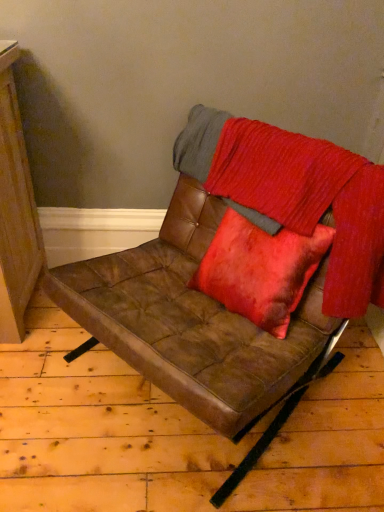
This screenshot has width=384, height=512. Describe the element at coordinates (213, 305) in the screenshot. I see `brown leather chair at center` at that location.

At what (x,y) coordinates should I click in order to perform the action: click on brown leather chair at center. Please return your answer as a coordinate pair (x, y). This screenshot has width=384, height=512. Looking at the image, I should click on (x=213, y=305).

The image size is (384, 512). Describe the element at coordinates (295, 195) in the screenshot. I see `velvet red blanket at center` at that location.

Where is `velvet red blanket at center`? velvet red blanket at center is located at coordinates (295, 195).

The width and height of the screenshot is (384, 512). What are the coordinates of `brown leather chair at center` in the screenshot? It's located at (213, 305).

Based on their positions, is velvet red blanket at center located to the left or right of brown leather chair at center?

Based on their positions, velvet red blanket at center is located to the right of brown leather chair at center.

Is velvet red blanket at center positioned before brown leather chair at center?

No, velvet red blanket at center is further to the viewer.

Does point (357, 290) come in front of point (81, 275)?

Yes, point (357, 290) is closer to viewer.

From the image's perspective, which is below, velvet red blanket at center or brown leather chair at center?

brown leather chair at center, from the image's perspective.

From a real-world perspective, relative to brown leather chair at center, is velvet red blanket at center vertically above or below?

In terms of real-world spatial position, velvet red blanket at center is above brown leather chair at center.

Between velvet red blanket at center and brown leather chair at center, which one has larger width?

brown leather chair at center is wider.

Who is shorter, velvet red blanket at center or brown leather chair at center?

With less height is velvet red blanket at center.

Is velvet red blanket at center smaller than brown leather chair at center?

Yes, velvet red blanket at center is smaller than brown leather chair at center.

Is velvet red blanket at center completely or partially outside of brown leather chair at center?

That's incorrect, velvet red blanket at center is not completely outside brown leather chair at center.

Consider the image. Is velvet red blanket at center with brown leather chair at center?

velvet red blanket at center and brown leather chair at center are clearly separated.

Is brown leather chair at center at the back of velvet red blanket at center?

Correct, velvet red blanket at center is looking away from brown leather chair at center.

Can you tell me how much velvet red blanket at center and brown leather chair at center differ in facing direction?

0.00124 degrees separate the facing orientations of velvet red blanket at center and brown leather chair at center.

Locate an element on the screen. The width and height of the screenshot is (384, 512). chair below the velvet red blanket at center (from the image's perspective) is located at coordinates (213, 305).

Which is more to the right, brown leather chair at center or velvet red blanket at center?

velvet red blanket at center.

Which object is further away from the camera, brown leather chair at center or velvet red blanket at center?

velvet red blanket at center.

Between point (201, 407) and point (193, 152), which one is positioned in front?

Positioned in front is point (201, 407).

From the image's perspective, which one is positioned higher, brown leather chair at center or velvet red blanket at center?

velvet red blanket at center.

From a real-world perspective, which is physically above, brown leather chair at center or velvet red blanket at center?

velvet red blanket at center.

Which of these two, brown leather chair at center or velvet red blanket at center, is wider?

brown leather chair at center is wider.

Who is taller, brown leather chair at center or velvet red blanket at center?

Standing taller between the two is brown leather chair at center.

Is brown leather chair at center bigger or smaller than velvet red blanket at center?

Clearly, brown leather chair at center is larger in size than velvet red blanket at center.

Consider the image. Could velvet red blanket at center be considered to be inside brown leather chair at center?

Yes, velvet red blanket at center is inside brown leather chair at center.

Looking at this image, is brown leather chair at center not close to velvet red blanket at center?

No, brown leather chair at center is not far away from velvet red blanket at center.

In the scene shown: Is brown leather chair at center oriented away from velvet red blanket at center?

Yes, velvet red blanket at center is at the back of brown leather chair at center.

How many degrees apart are the facing directions of brown leather chair at center and velvet red blanket at center?

0.00124 degrees.

The image size is (384, 512). Identify the location of chair that is on the left side of velvet red blanket at center. (213, 305).

Locate an element on the screen. chair that is in front of the velvet red blanket at center is located at coordinates (213, 305).

I want to click on blanket above the brown leather chair at center (from the image's perspective), so click(295, 195).